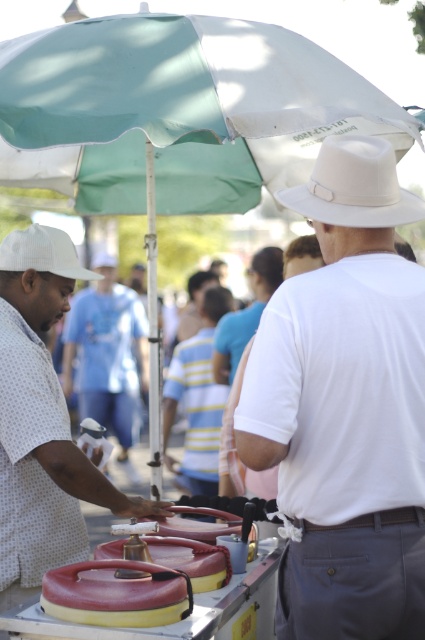
Does white matte hat at upper center appear on the left side of white felt cowboy hat at upper center?

Correct, you'll find white matte hat at upper center to the left of white felt cowboy hat at upper center.

Between point (337, 449) and point (374, 218), which one is positioned in front?

Point (337, 449) is in front.

Identify the location of white matte hat at upper center. The image size is (425, 640). (345, 406).

Is white matte hat at upper center smaller than white matte shirt at center?

Yes.

Is point (408, 570) less distant than point (112, 429)?

Yes.

In order to click on white matte hat at upper center in this screenshot , I will do `click(345, 406)`.

Is white dotted shirt at left to the right of white fabric cowboy hat at left from the viewer's perspective?

Yes, white dotted shirt at left is to the right of white fabric cowboy hat at left.

Is point (20, 344) positioned in front of point (93, 275)?

Yes, it is.

This screenshot has width=425, height=640. Identify the location of white dotted shirt at left. (42, 420).